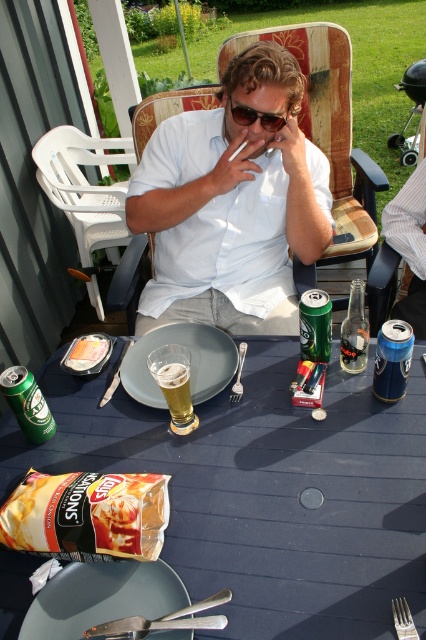
Is point (370, 525) positioned behind point (273, 128)?

No, it is in front of (273, 128).

Can you confirm if blue wood table at center is positioned below black plastic sunglasses at center?

Yes.

I want to click on blue wood table at center, so click(x=265, y=490).

Does point (253, 260) come in front of point (273, 116)?

That is False.

Does point (262, 208) come behind point (230, 100)?

Yes.

Locate an element on the screen. The height and width of the screenshot is (640, 426). white cotton shirt at center is located at coordinates (232, 204).

From the picture: Can you confirm if white cotton shirt at center is smaller than matte brown chips at lower left?

No.

In the scene shown: Between white cotton shirt at center and matte brown chips at lower left, which one appears on the right side from the viewer's perspective?

Positioned to the right is white cotton shirt at center.

At what (x,y) coordinates should I click in order to perform the action: click on white cotton shirt at center. Please return your answer as a coordinate pair (x, y). The height and width of the screenshot is (640, 426). Looking at the image, I should click on (232, 204).